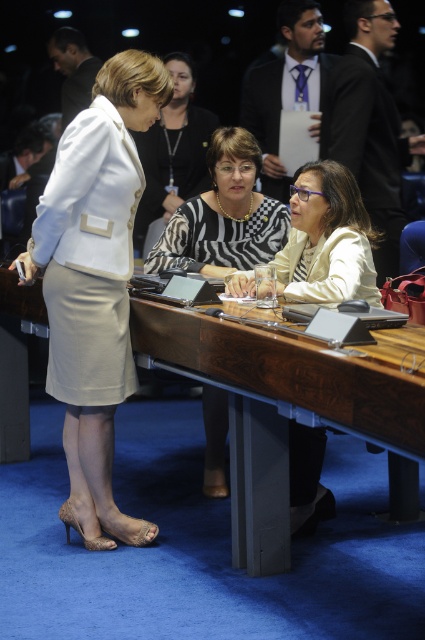
Is point (325, 234) in front of point (189, 205)?

Yes, point (325, 234) is in front of point (189, 205).

From the picture: Measure the distance between point (238, 288) and camera.

Point (238, 288) is 3.10 meters from camera.

Is point (305, 493) positioned behind point (218, 256)?

No, (305, 493) is closer to viewer.

Identify the location of matte beige blazer at center. (326, 237).

Which is below, zebra-patterned blouse at center or zebra print blouse at center?

Answer: Positioned lower is zebra-patterned blouse at center.

Describe the element at coordinates (223, 216) in the screenshot. I see `zebra-patterned blouse at center` at that location.

At what (x,y) coordinates should I click in order to perform the action: click on zebra-patterned blouse at center. Please return your answer as a coordinate pair (x, y). This screenshot has height=640, width=425. Looking at the image, I should click on (223, 216).

Does wooden at center appear on the right side of zebra print blouse at center?

Yes, wooden at center is to the right of zebra print blouse at center.

Which is more to the left, wooden at center or zebra print blouse at center?

From the viewer's perspective, zebra print blouse at center appears more on the left side.

Consider the image. Who is more forward, (275, 522) or (161, 128)?

Point (275, 522) is in front.

You are a GUI agent. You are given a task and a screenshot of the screen. Output one action in this format:
    pyautogui.click(x=<x>, y=<y>)
    Task: Click on the wooden at center
    
    Given the screenshot: What is the action you would take?
    pyautogui.click(x=288, y=408)